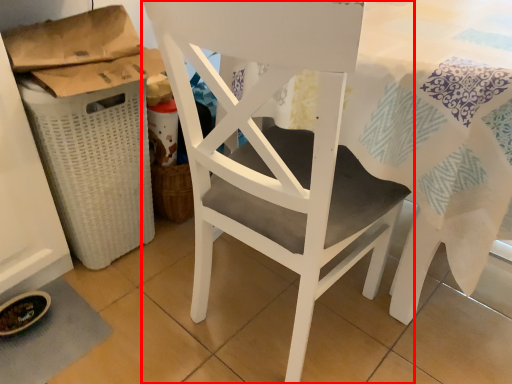
Question: From the image's perspective, what is the correct spatial positioning of chair (annotated by the red box) in reference to laundry basket?

Choices:
 (A) above
 (B) below

Answer: (B)